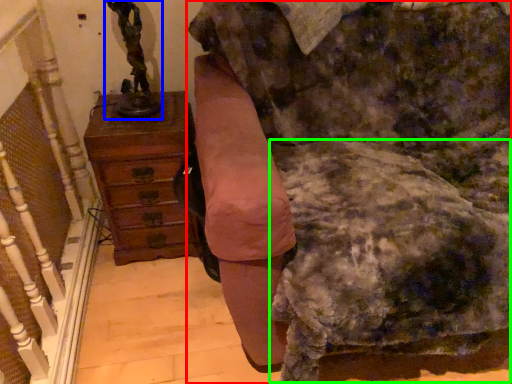
Question: Estimate the real-world distances between objects in this image. Which object is farther from furniture (highlighted by a red box), sculpture (highlighted by a blue box) or swivel chair (highlighted by a green box)?

Choices:
 (A) sculpture
 (B) swivel chair

Answer: (A)